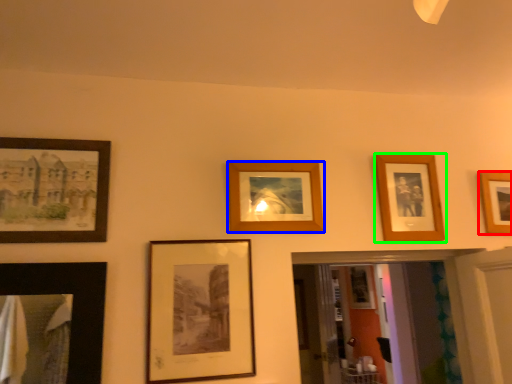
Question: Which object is positioned farthest from picture frame (highlighted by a red box)? Select from picture frame (highlighted by a blue box) and picture frame (highlighted by a green box).

Choices:
 (A) picture frame
 (B) picture frame

Answer: (A)